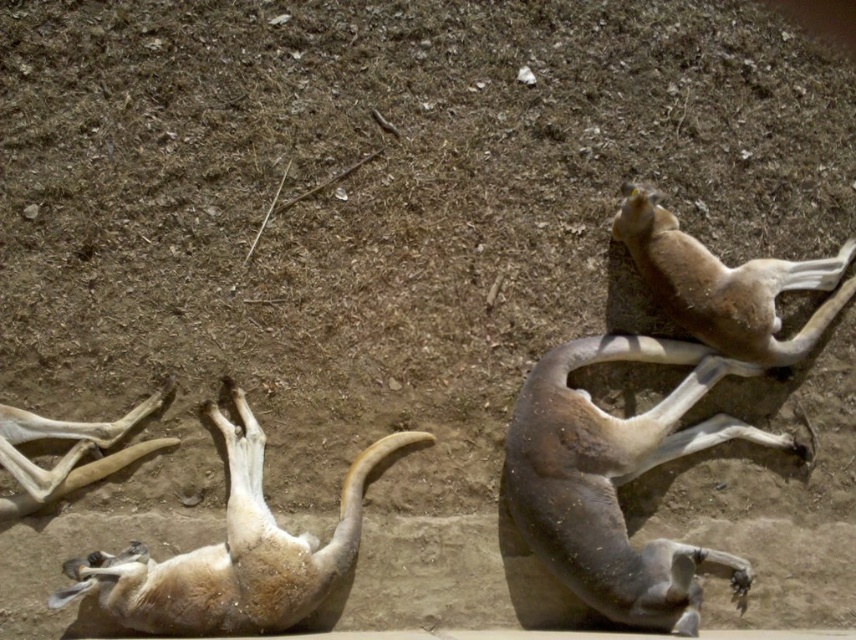
Question: Which point is farther to the camera?

Choices:
 (A) light brown fur at lower left
 (B) brown matte animal at upper right

Answer: (B)

Question: Is brown matte animal at right bigger than light brown bone at lower left?

Choices:
 (A) no
 (B) yes

Answer: (B)

Question: Can you confirm if brown matte animal at right is positioned to the left of light brown fur at lower left?

Choices:
 (A) no
 (B) yes

Answer: (A)

Question: Is light brown fur at lower left bigger than light brown bone at lower left?

Choices:
 (A) yes
 (B) no

Answer: (A)

Question: Among these objects, which one is nearest to the camera?

Choices:
 (A) light brown fur at lower left
 (B) light brown bone at lower left

Answer: (A)

Question: Which point is farther from the camera taking this photo?

Choices:
 (A) [x=613, y=577]
 (B) [x=250, y=516]
 (C) [x=724, y=312]

Answer: (C)